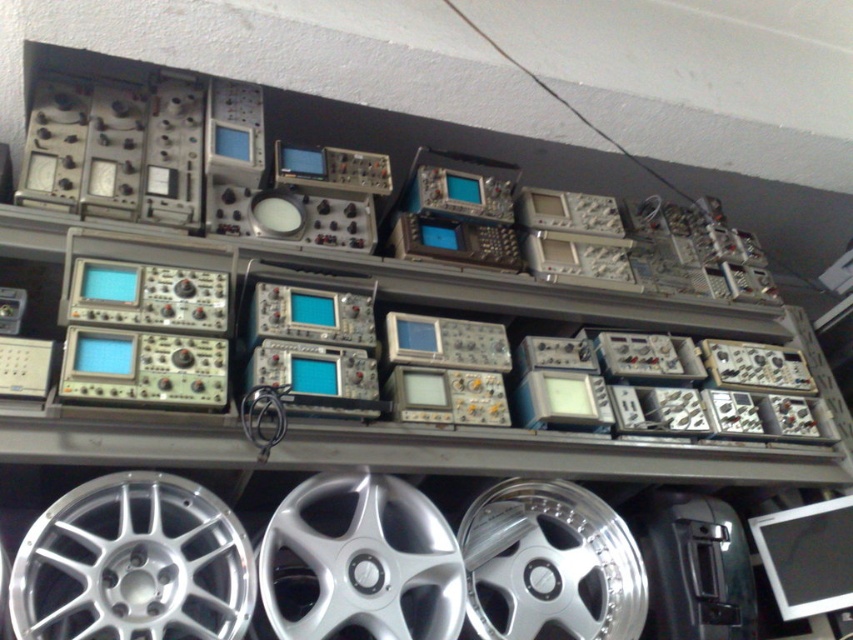
Question: Which is nearer to the silver metallic wheel at center?

Choices:
 (A) silver polished wheel at lower center
 (B) silver metallic wheel at lower left

Answer: (A)

Question: Among these points, which one is farthest from the camera?

Choices:
 (A) click(x=445, y=593)
 (B) click(x=221, y=536)
 (C) click(x=541, y=538)

Answer: (C)

Question: Is silver metallic wheel at center smaller than silver polished wheel at lower center?

Choices:
 (A) no
 (B) yes

Answer: (A)

Question: Which of the following is the closest to the observer?

Choices:
 (A) silver metallic wheel at center
 (B) silver polished wheel at lower center
 (C) silver metallic wheel at lower left

Answer: (C)

Question: Can you confirm if silver metallic wheel at lower left is thinner than silver metallic wheel at center?

Choices:
 (A) no
 (B) yes

Answer: (A)

Question: Does silver metallic wheel at lower left have a greater width compared to silver metallic wheel at center?

Choices:
 (A) no
 (B) yes

Answer: (B)